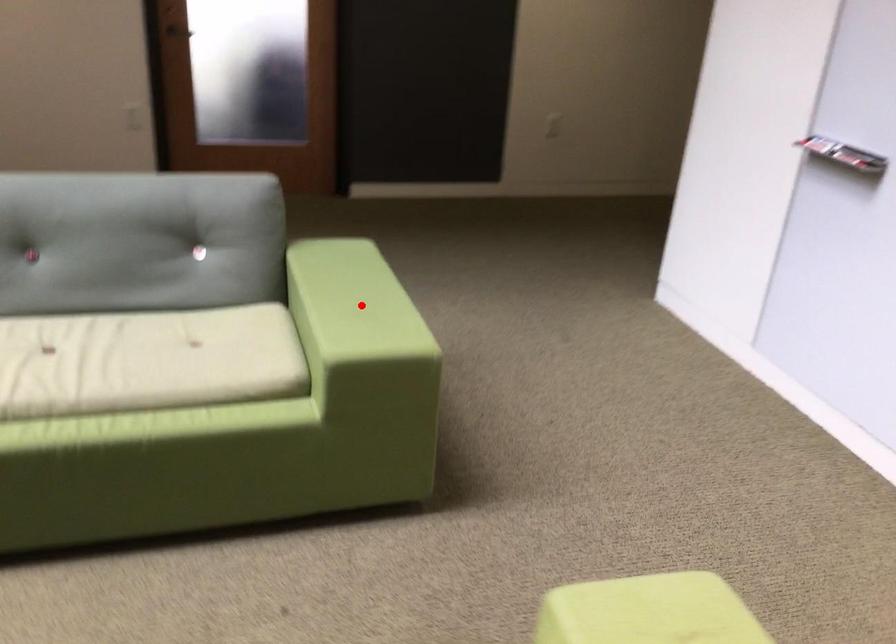
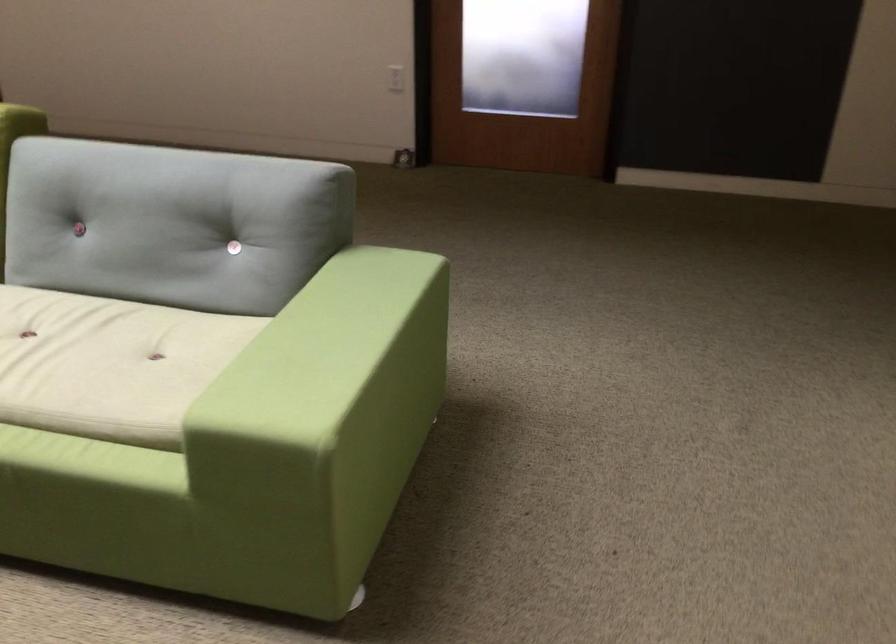
Locate, in the second image, the point that corresponds to the highlighted location in the first image.

(323, 353)